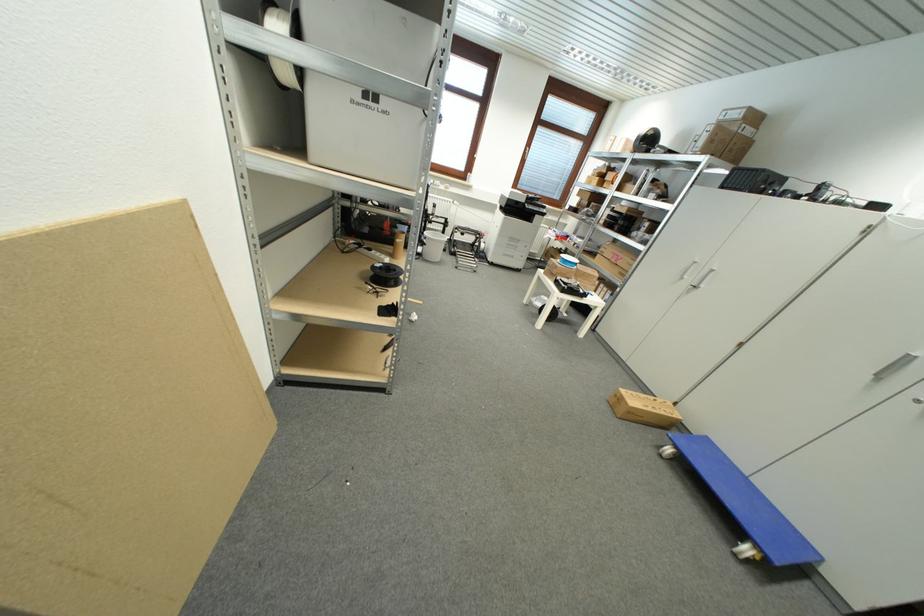
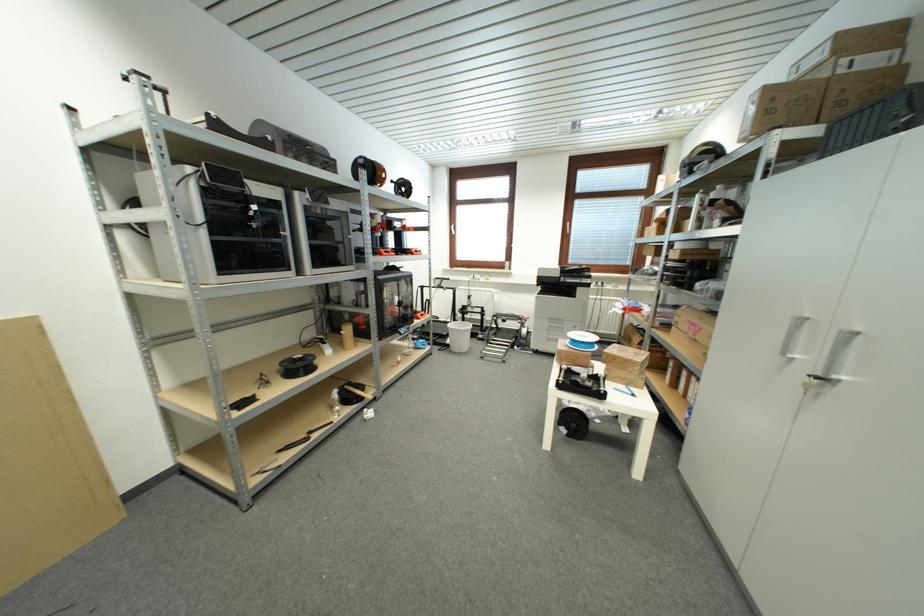
The point at (716,130) is marked in the first image. Where is the corresponding point in the second image?

(761, 99)